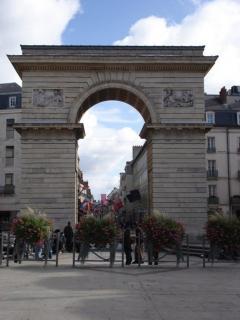
Find the location of a particular element. Image resolution: width=240 pixels, height=320 pixels. flower stands is located at coordinates (122, 258), (46, 250), (187, 252), (204, 252).